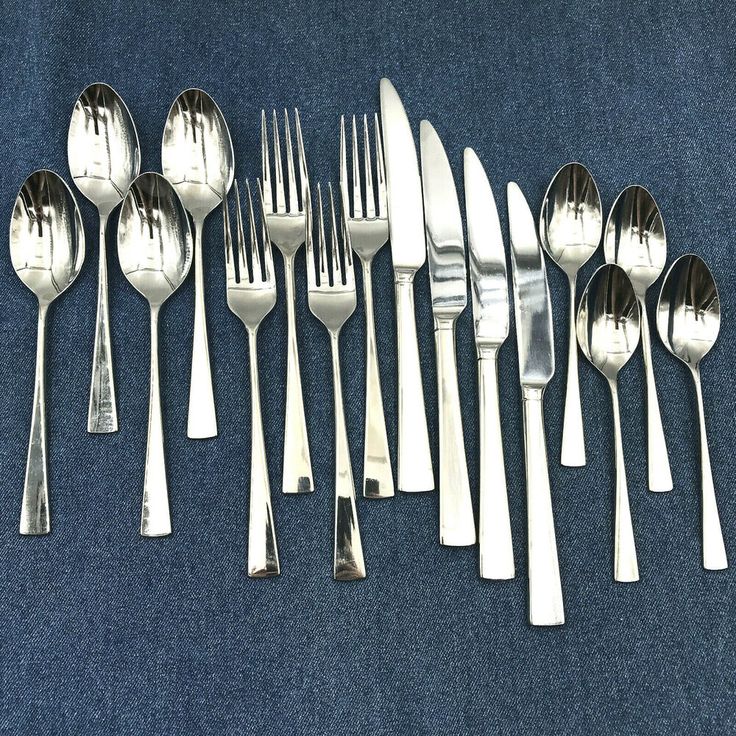
The image size is (736, 736). What are the coordinates of `butter knives` in the screenshot? It's located at (403, 243), (456, 269), (488, 300), (545, 355).